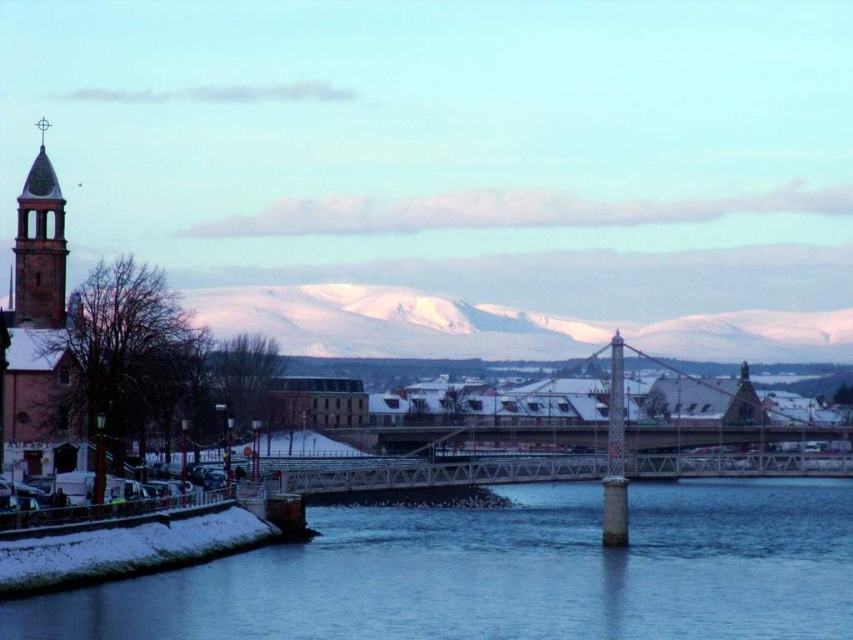
Question: Among these points, which one is nearest to the camera?

Choices:
 (A) (41, 180)
 (B) (688, 547)
 (C) (38, 310)
 (D) (309, 337)

Answer: (B)

Question: Which of the following is the closest to the observer?

Choices:
 (A) matte brick clock tower at left
 (B) snow-covered mountain at center

Answer: (A)

Question: Based on their relative distances, which object is farther from the clear water at lower center?

Choices:
 (A) matte brick church steeple at left
 (B) matte brick clock tower at left
 (C) snow-covered mountain at center

Answer: (C)

Question: Does clear water at lower center appear over matte brick church steeple at left?

Choices:
 (A) yes
 (B) no

Answer: (B)

Question: In this image, where is clear water at lower center located relative to matte brick church steeple at left?

Choices:
 (A) above
 (B) below

Answer: (B)

Question: Can you confirm if clear water at lower center is wider than matte brick clock tower at left?

Choices:
 (A) no
 (B) yes

Answer: (B)